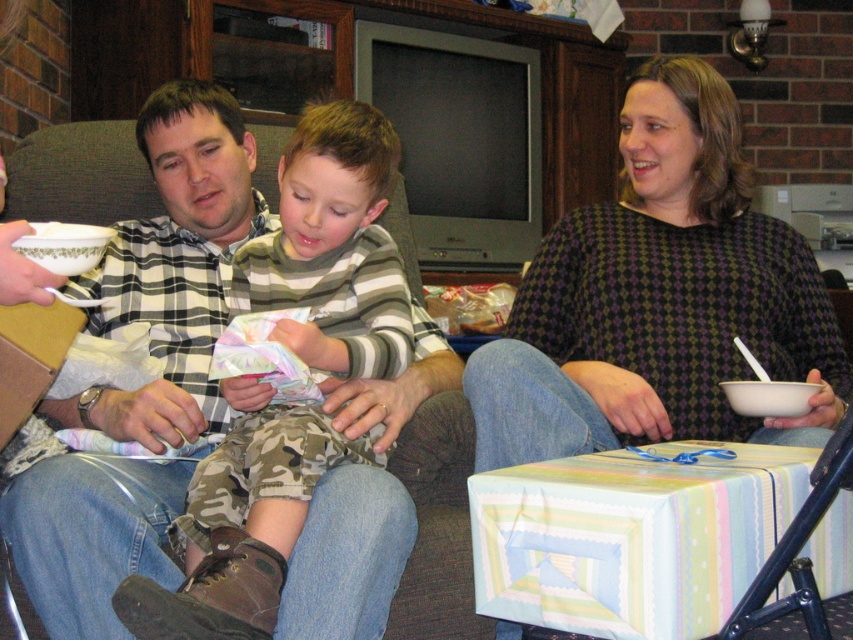
Based on the photo, does dark green diamond-patterned sweater at center have a lesser height compared to striped cotton shirt at center?

Indeed, dark green diamond-patterned sweater at center has a lesser height compared to striped cotton shirt at center.

Who is more forward, (801, 314) or (375, 282)?

Point (375, 282) is more forward.

Where is `dark green diamond-patterned sweater at center`? The image size is (853, 640). dark green diamond-patterned sweater at center is located at coordinates (659, 298).